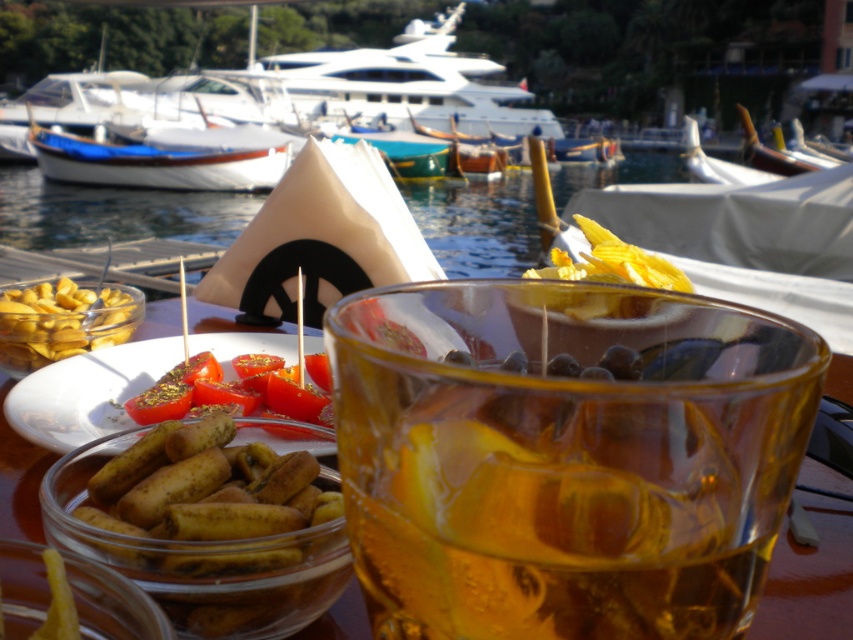
Can you confirm if translucent amber liquid at center is thinner than yellow crispy chips at center?

Indeed, translucent amber liquid at center has a lesser width compared to yellow crispy chips at center.

Between point (547, 355) and point (635, 273), which one is positioned behind?

Point (635, 273)

Where is `translucent amber liquid at center`? The width and height of the screenshot is (853, 640). translucent amber liquid at center is located at coordinates (566, 456).

Locate an element on the screen. The height and width of the screenshot is (640, 853). translucent amber liquid at center is located at coordinates (566, 456).

In the scene shown: Does translucent amber liquid at center appear under greenish-brown crispy rolls at lower left?

Incorrect, translucent amber liquid at center is not positioned below greenish-brown crispy rolls at lower left.

Does translucent amber liquid at center have a greater height compared to greenish-brown crispy rolls at lower left?

Yes, translucent amber liquid at center is taller than greenish-brown crispy rolls at lower left.

In the scene shown: Who is more forward, (634, 536) or (274, 624)?

Positioned in front is point (634, 536).

The height and width of the screenshot is (640, 853). I want to click on translucent amber liquid at center, so click(x=566, y=456).

Which is behind, point (422, 310) or point (281, 394)?

The point (281, 394) is more distant.

This screenshot has width=853, height=640. I want to click on translucent amber liquid at center, so click(566, 456).